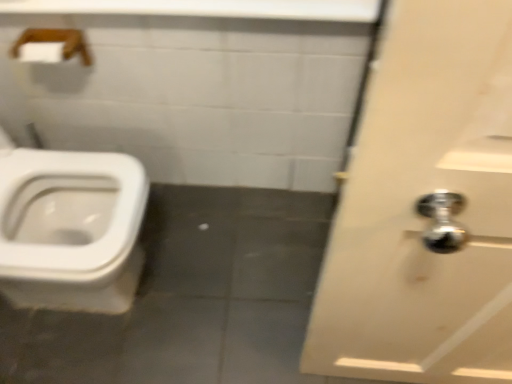
Find the location of a particular element. wooden towel bar at upper left is located at coordinates (51, 45).

Based on the photo, which of these two, white glossy counter top at upper center or white glossy door at right, stands shorter?

Standing shorter between the two is white glossy counter top at upper center.

From the image's perspective, is white glossy counter top at upper center under white glossy door at right?

Incorrect, from the image's perspective, white glossy counter top at upper center is higher than white glossy door at right.

Between point (339, 12) and point (411, 27), which one is positioned in front?

The point (411, 27) is closer.

Is wooden towel bar at upper left wider or thinner than white glossy door at right?

wooden towel bar at upper left is wider than white glossy door at right.

Does point (53, 29) come farther from viewer compared to point (352, 248)?

Yes, point (53, 29) is behind point (352, 248).

From the image's perspective, is wooden towel bar at upper left over white glossy door at right?

Yes, from the image's perspective, wooden towel bar at upper left is over white glossy door at right.

From a real-world perspective, between wooden towel bar at upper left and white glossy door at right, who is vertically higher?

wooden towel bar at upper left is physically above.

Between white glossy door at right and white glossy counter top at upper center, which one has larger size?

white glossy door at right.

From a real-world perspective, which object rests below the other?

white glossy door at right, from a real-world perspective.

Would you say white glossy door at right contains white glossy counter top at upper center?

No, white glossy door at right does not contain white glossy counter top at upper center.

Measure the distance from white glossy door at right to white glossy counter top at upper center.

white glossy door at right and white glossy counter top at upper center are 28.01 inches apart from each other.

Which of these two, white glossy door at right or wooden towel bar at upper left, is bigger?

Bigger between the two is white glossy door at right.

From a real-world perspective, does white glossy door at right stand above wooden towel bar at upper left?

No, from a real-world perspective, white glossy door at right is not over wooden towel bar at upper left

Considering the relative sizes of white glossy door at right and wooden towel bar at upper left in the image provided, is white glossy door at right thinner than wooden towel bar at upper left?

Yes.

Is white glossy counter top at upper center completely or partially inside wooden towel bar at upper left?

No, wooden towel bar at upper left does not contain white glossy counter top at upper center.

Could you tell me if wooden towel bar at upper left is turned towards white glossy counter top at upper center?

No.

Considering the points (71, 43) and (313, 13), which point is in front, point (71, 43) or point (313, 13)?

Positioned in front is point (313, 13).

Is wooden towel bar at upper left positioned before white glossy counter top at upper center?

No, it is not.

Considering the relative positions of white glossy counter top at upper center and wooden towel bar at upper left in the image provided, is white glossy counter top at upper center behind wooden towel bar at upper left?

That is False.

What's the angular difference between white glossy counter top at upper center and wooden towel bar at upper left's facing directions?

There is a 2.92-degree angle between the facing directions of white glossy counter top at upper center and wooden towel bar at upper left.

Does white glossy counter top at upper center have a larger size compared to wooden towel bar at upper left?

Correct, white glossy counter top at upper center is larger in size than wooden towel bar at upper left.

Would you say white glossy counter top at upper center is outside wooden towel bar at upper left?

Yes, white glossy counter top at upper center is not within wooden towel bar at upper left.

Identify the location of door in front of the white glossy counter top at upper center. The image size is (512, 384). (425, 208).

Find the location of a particular element. The height and width of the screenshot is (384, 512). door below the wooden towel bar at upper left (from a real-world perspective) is located at coordinates (425, 208).

Estimate the real-world distances between objects in this image. Which object is closer to white glossy counter top at upper center, white glossy door at right or wooden towel bar at upper left?

wooden towel bar at upper left.

Looking at the image, which one is located closer to wooden towel bar at upper left, white glossy door at right or white glossy counter top at upper center?

Based on the image, white glossy counter top at upper center appears to be nearer to wooden towel bar at upper left.

Looking at the image, which one is located closer to white glossy door at right, wooden towel bar at upper left or white glossy counter top at upper center?

Among the two, white glossy counter top at upper center is located nearer to white glossy door at right.

Which object lies nearer to the anchor point wooden towel bar at upper left, white glossy counter top at upper center or white glossy door at right?

white glossy counter top at upper center is positioned closer to the anchor wooden towel bar at upper left.

Based on their spatial positions, is white glossy counter top at upper center or wooden towel bar at upper left further from white glossy door at right?

wooden towel bar at upper left.

Based on the photo, which object lies further to the anchor point white glossy counter top at upper center, wooden towel bar at upper left or white glossy door at right?

white glossy door at right lies further to white glossy counter top at upper center than the other object.

The height and width of the screenshot is (384, 512). Find the location of `counter top located between wooden towel bar at upper left and white glossy door at right in the left-right direction`. counter top located between wooden towel bar at upper left and white glossy door at right in the left-right direction is located at coordinates (207, 8).